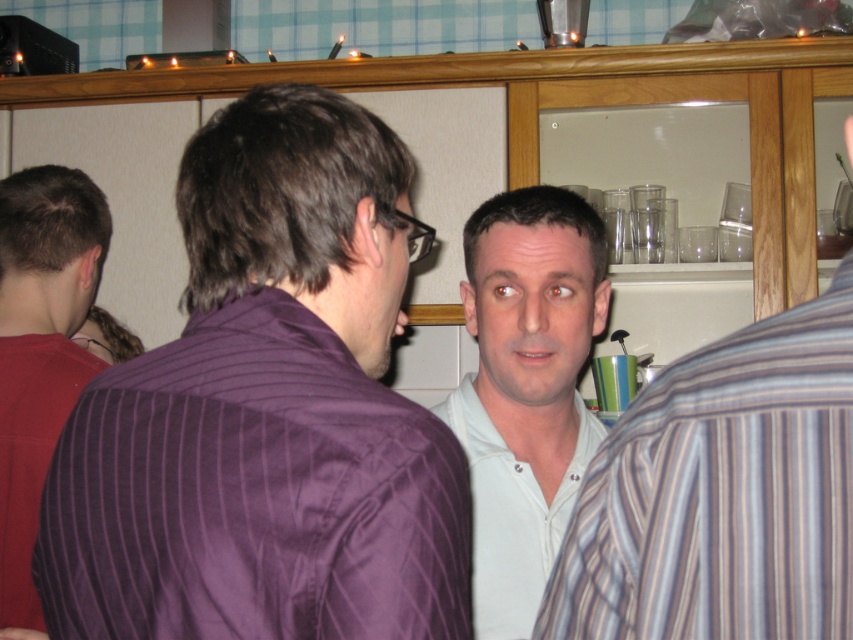
Is white smooth shirt at center smaller than matte purple shirt at left?

Indeed, white smooth shirt at center has a smaller size compared to matte purple shirt at left.

Can you confirm if white smooth shirt at center is positioned to the right of matte purple shirt at left?

Indeed, white smooth shirt at center is positioned on the right side of matte purple shirt at left.

Which is behind, point (784, 353) or point (10, 554)?

The point (10, 554) is more distant.

Where is `white smooth shirt at center`? white smooth shirt at center is located at coordinates (722, 493).

Between purple striped shirt at center and matte purple shirt at left, which one has less height?

With less height is purple striped shirt at center.

Which is in front, point (374, 435) or point (12, 456)?

Point (374, 435) is more forward.

Locate an element on the screen. This screenshot has width=853, height=640. purple striped shirt at center is located at coordinates (267, 412).

Is white smooth shirt at center in front of white cotton shirt at center?

Yes, white smooth shirt at center is in front of white cotton shirt at center.

Which is behind, point (782, 580) or point (554, 524)?

Positioned behind is point (554, 524).

Is point (711, 484) farther from viewer compared to point (573, 449)?

No, it is in front of (573, 449).

Where is `white smooth shirt at center`? white smooth shirt at center is located at coordinates (722, 493).